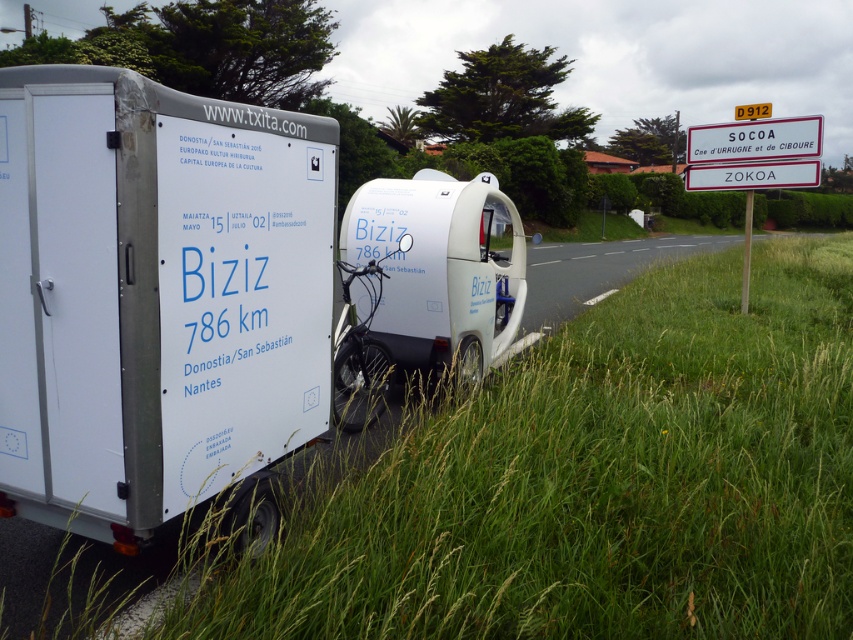
You are a photographer trying to capture the white plastic sign at upper right in the image. You notice there is green grass at lower right in the frame. Which object is narrower in width so it won t interfere with your shot of the sign?

The green grass at lower right is thinner than the white plastic sign at upper right, so the green grass at lower right won t interfere with the shot of the white plastic sign at upper right because it is narrower in width.

You are a pedestrian standing on the roadside and see the white matte trailer at left and the white plastic sign at upper right. Which object is positioned lower in the scene?

The white matte trailer at left is positioned below the white plastic sign at upper right, so it is lower in the scene.

You are a photographer planning to take a picture of the white matte trailer at left and the white plastic sign at upper right. Which object should you focus on first if you want to capture both in a single frame without moving the camera?

The white matte trailer at left is smaller than the white plastic sign at upper right, so you should focus on the white plastic sign at upper right first to ensure it fits properly in the frame.